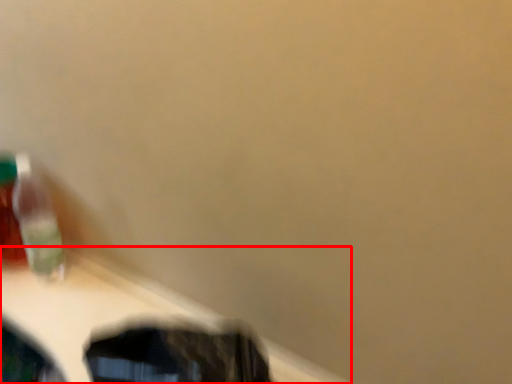
Question: Where is table (annotated by the red box) located in relation to toothbrush in the image?

Choices:
 (A) right
 (B) left

Answer: (A)